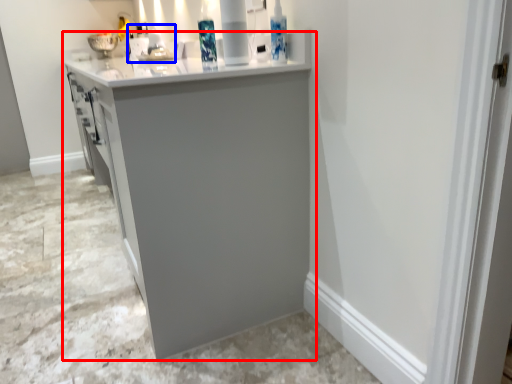
Question: Which object appears farthest to the camera in this image, cabinetry (highlighted by a red box) or sink (highlighted by a blue box)?

Choices:
 (A) cabinetry
 (B) sink

Answer: (B)